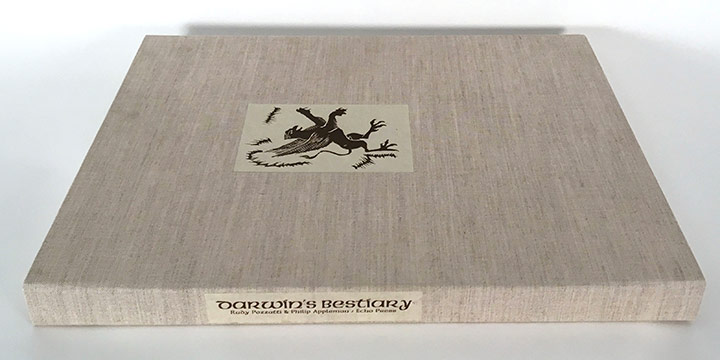
Identify the location of book spine. The width and height of the screenshot is (720, 360). (453, 305).